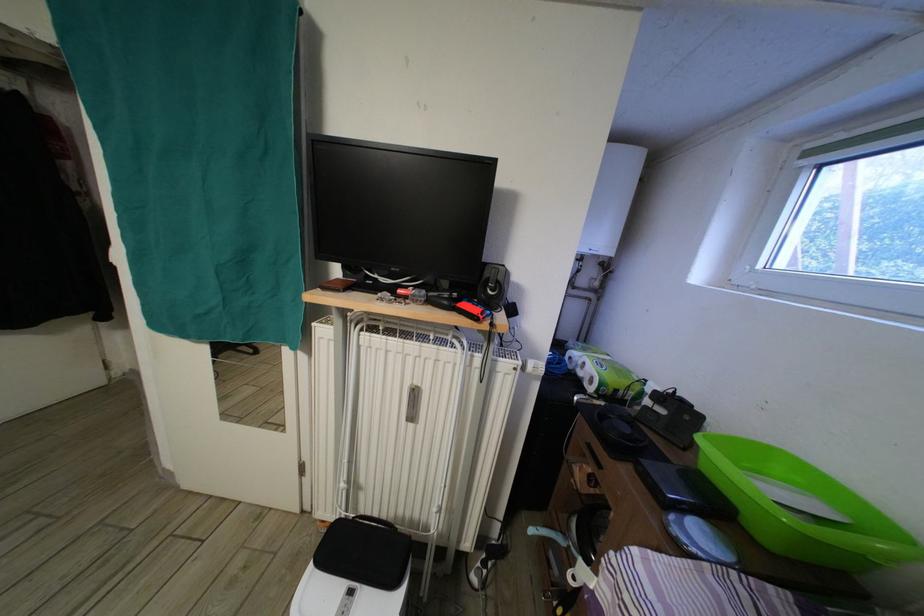
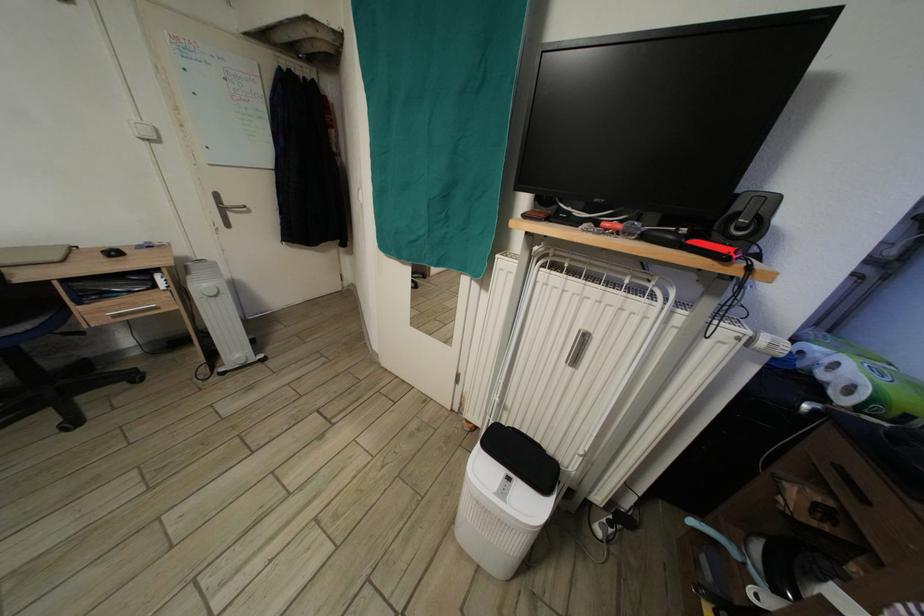
In the second image, find the point that corresponds to point 588,379 in the first image.

(830, 383)